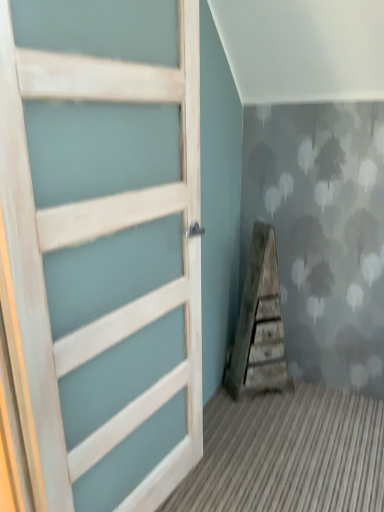
In order to click on free space in front of weathered wood staircase at center in this screenshot , I will do `click(269, 419)`.